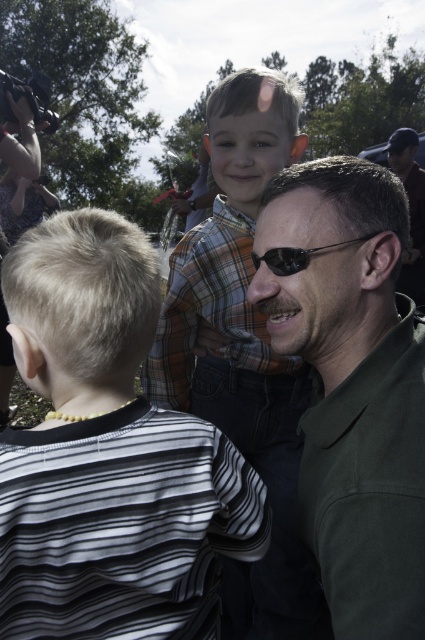
Question: Which of the following is the closest to the observer?

Choices:
 (A) (308, 602)
 (B) (252, 253)
 (C) (17, 486)

Answer: (C)

Question: Is black striped shirt at left thinner than plaid shirt at center?

Choices:
 (A) no
 (B) yes

Answer: (B)

Question: Is green matte shirt at center wider than plaid shirt at center?

Choices:
 (A) yes
 (B) no

Answer: (B)

Question: Which object appears closest to the camera in this image?

Choices:
 (A) black striped shirt at left
 (B) black plastic sunglasses at center
 (C) plaid shirt at center
 (D) green matte shirt at center

Answer: (D)

Question: Observing the image, what is the correct spatial positioning of plaid shirt at center in reference to black plastic sunglasses at center?

Choices:
 (A) left
 (B) right

Answer: (A)

Question: Among these points, which one is farthest from the camera?

Choices:
 (A) (379, 556)
 (B) (277, 266)

Answer: (B)